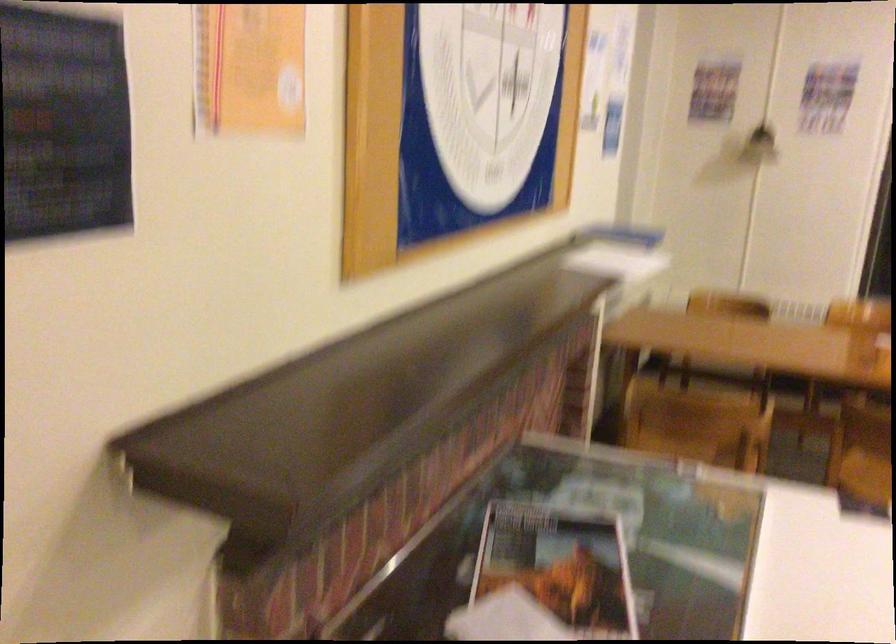
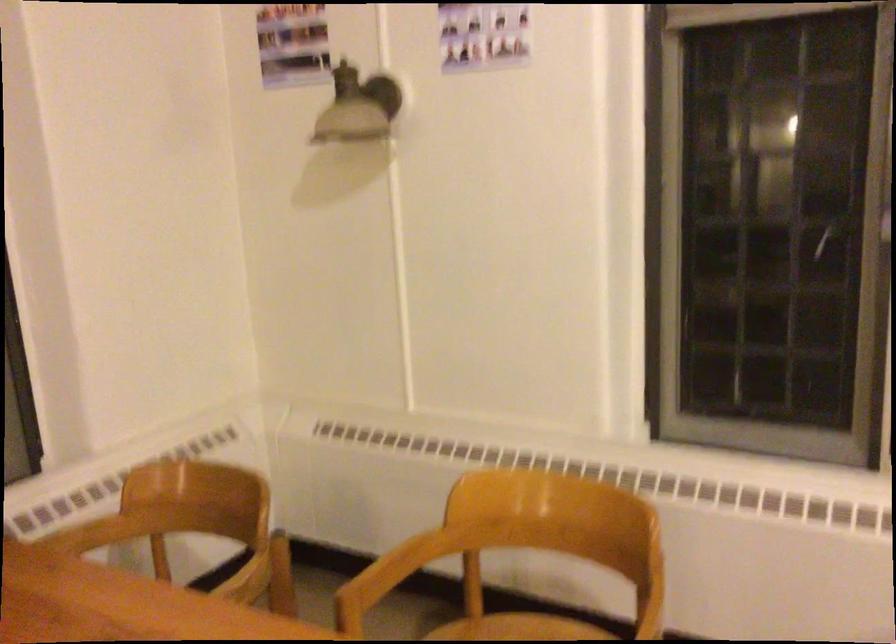
The images are taken continuously from a first-person perspective. In which direction are you moving?

The cameraman moved toward right, forward.